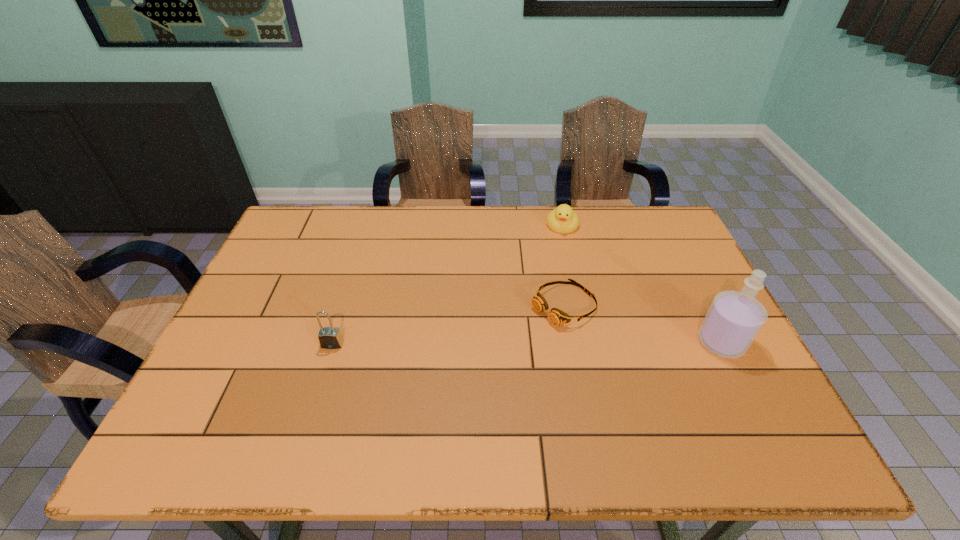
Identify the location of the leftmost object. (329, 337).

Identify the location of the third shortest object. (329, 337).

Identify the location of the rightmost object. The width and height of the screenshot is (960, 540). (734, 319).

At what (x,y) coordinates should I click in order to perform the action: click on the tallest object. Please return your answer as a coordinate pair (x, y). Looking at the image, I should click on (734, 319).

Locate an element on the screen. duckling is located at coordinates (x=563, y=219).

The image size is (960, 540). In order to click on the second shortest object in this screenshot , I will do `click(563, 219)`.

This screenshot has height=540, width=960. Find the location of `the shortest object`. the shortest object is located at coordinates (556, 316).

Where is `vacant space located on the shackle of the leftmost object`? This screenshot has width=960, height=540. vacant space located on the shackle of the leftmost object is located at coordinates pos(324,369).

Identify the location of vacant space located on the back of the perfume. (680, 260).

This screenshot has width=960, height=540. Find the location of `free space located on the face of the farthest object`. free space located on the face of the farthest object is located at coordinates (559, 247).